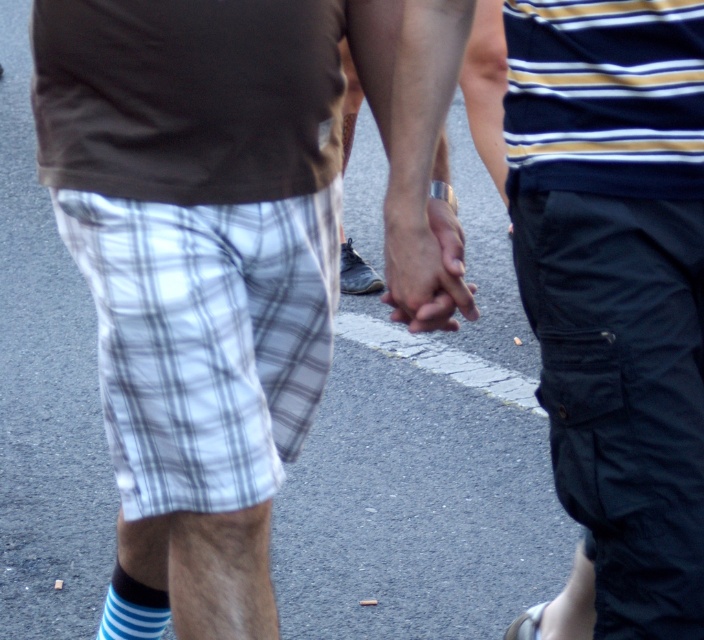
Does point (567, 292) lie in front of point (572, 138)?

That is False.

Is dark blue cargo pants at right bigger than blue and white checkered shorts at center?

Indeed, dark blue cargo pants at right has a larger size compared to blue and white checkered shorts at center.

Who is more forward, [629,592] or [612,99]?

Point [612,99]

The image size is (704, 640). In order to click on dark blue cargo pants at right in this screenshot , I will do `click(616, 285)`.

From the picture: Is white plaid shorts at center to the right of blue and white checkered shorts at center from the viewer's perspective?

Incorrect, white plaid shorts at center is not on the right side of blue and white checkered shorts at center.

At what (x,y) coordinates should I click in order to perform the action: click on white plaid shorts at center. Please return your answer as a coordinate pair (x, y). The image size is (704, 640). Looking at the image, I should click on (203, 259).

Is white plaid shorts at lower left smaller than blue and white checkered shorts at center?

Actually, white plaid shorts at lower left might be larger than blue and white checkered shorts at center.

This screenshot has width=704, height=640. I want to click on white plaid shorts at lower left, so click(x=206, y=339).